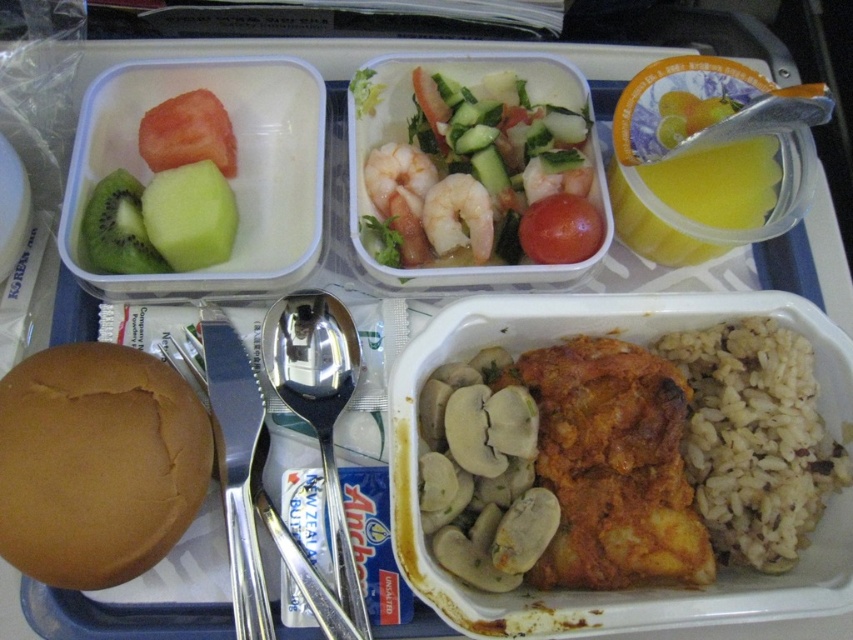
Can you confirm if shiny orange shrimp at center is smaller than brown matte rice at lower right?

Actually, shiny orange shrimp at center might be larger than brown matte rice at lower right.

Between point (468, 221) and point (785, 488), which one is positioned behind?

Point (468, 221)

Is point (503, 150) closer to camera compared to point (759, 486)?

No.

Image resolution: width=853 pixels, height=640 pixels. Find the location of `shiny orange shrimp at center`. shiny orange shrimp at center is located at coordinates (474, 166).

Can you confirm if brown matte bun at lower left is bigger than yellow translucent cup at upper right?

Yes.

Can you confirm if brown matte bun at lower left is smaller than yellow translucent cup at upper right?

Actually, brown matte bun at lower left might be larger than yellow translucent cup at upper right.

Between point (3, 452) and point (769, 172), which one is positioned behind?

Positioned behind is point (769, 172).

Image resolution: width=853 pixels, height=640 pixels. I want to click on brown matte bun at lower left, so click(97, 464).

Who is more forward, (379, 193) or (137, 218)?

Point (137, 218) is more forward.

Does shiny orange shrimp at center have a lesser height compared to green matte kiwi at upper left?

No.

Find the location of a particular element. The height and width of the screenshot is (640, 853). shiny orange shrimp at center is located at coordinates (474, 166).